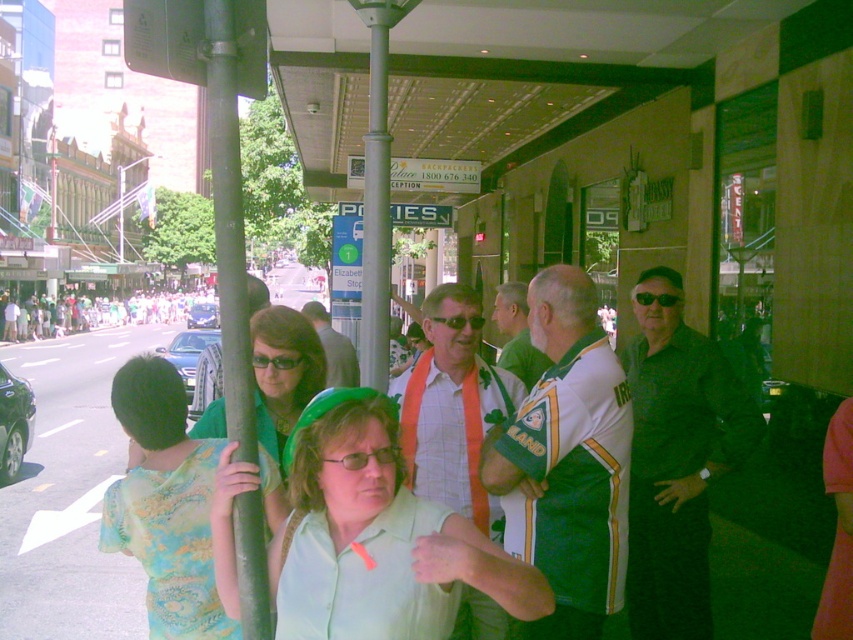
Who is positioned more to the left, white plastic pole at center or orange fabric shirt at center?

Positioned to the left is orange fabric shirt at center.

Where is `white plastic pole at center`? This screenshot has width=853, height=640. white plastic pole at center is located at coordinates (375, 218).

Between metallic green sign at center and black plastic sunglasses at center, which one has more height?

Standing taller between the two is metallic green sign at center.

Is metallic green sign at center to the right of black plastic sunglasses at center from the viewer's perspective?

In fact, metallic green sign at center is to the left of black plastic sunglasses at center.

Is point (419, 205) more distant than point (641, 301)?

Yes.

This screenshot has height=640, width=853. Find the location of `metallic green sign at center`. metallic green sign at center is located at coordinates (421, 214).

From the picture: Does white plastic pole at center have a greater width compared to clear plastic glasses at center?

Yes, white plastic pole at center is wider than clear plastic glasses at center.

Is white plastic pole at center shorter than clear plastic glasses at center?

No.

You are a GUI agent. You are given a task and a screenshot of the screen. Output one action in this format:
    pyautogui.click(x=<x>, y=<y>)
    Task: Click on the white plastic pole at center
    The height and width of the screenshot is (640, 853).
    Given the screenshot: What is the action you would take?
    pyautogui.click(x=375, y=218)

The image size is (853, 640). What are the coordinates of `white plastic pole at center` in the screenshot? It's located at (375, 218).